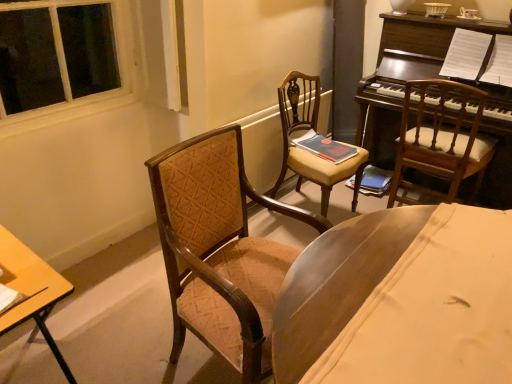
This screenshot has width=512, height=384. Describe the element at coordinates (441, 138) in the screenshot. I see `wooden chair at right, which ranks as the 3th chair in left-to-right order` at that location.

What is the approximate height of wooden desk at lower left?

wooden desk at lower left is 28.07 inches tall.

Image resolution: width=512 pixels, height=384 pixels. I want to click on dark brown polished wood piano at upper right, so click(405, 73).

This screenshot has height=384, width=512. What do you see at coordinates (405, 73) in the screenshot?
I see `dark brown polished wood piano at upper right` at bounding box center [405, 73].

What do you see at coordinates (375, 181) in the screenshot?
I see `hardcover book at center, positioned as the 2th book in front-to-back order` at bounding box center [375, 181].

Image resolution: width=512 pixels, height=384 pixels. What are the coordinates of `matte brown wooden chair at center, which is counted as the 2th chair, starting from the right` in the screenshot? It's located at (305, 134).

Locate an element on the screen. wooden chair at right, which ranks as the 3th chair in left-to-right order is located at coordinates (441, 138).

Could you tell me if matte brown wooden chair at center, which is the second chair from left to right, is turned towards wooden desk at lower left?

No, matte brown wooden chair at center, which is the second chair from left to right, is not turned towards wooden desk at lower left.

Can you see matte brown wooden chair at center, which is the second chair from left to right, touching wooden desk at lower left?

No, matte brown wooden chair at center, which is the second chair from left to right, is not next to wooden desk at lower left.

Image resolution: width=512 pixels, height=384 pixels. What are the coordinates of `desk below the matte brown wooden chair at center, which is counted as the 2th chair, starting from the right (from the image's perspective)` in the screenshot? It's located at (32, 291).

Considering the relative positions of velvet brown armchair at center, positioned as the 1th chair in left-to-right order, and hardcover book at center, the second book when ordered from left to right, in the image provided, is velvet brown armchair at center, positioned as the 1th chair in left-to-right order, to the left or to the right of hardcover book at center, the second book when ordered from left to right,?

velvet brown armchair at center, positioned as the 1th chair in left-to-right order, is positioned on hardcover book at center, the second book when ordered from left to right,'s left side.

Is velvet brown armchair at center, the third chair when ordered from right to left, thinner than hardcover book at center, which is counted as the first book, starting from the back?

No.

Can you tell me how much velvet brown armchair at center, the third chair when ordered from right to left, and hardcover book at center, the 1th book positioned from the right, differ in facing direction?

velvet brown armchair at center, the third chair when ordered from right to left, and hardcover book at center, the 1th book positioned from the right, are facing 93.8 degrees away from each other.

Considering the relative sizes of velvet brown armchair at center, the third chair when ordered from right to left, and hardcover book at center, which is counted as the first book, starting from the back, in the image provided, is velvet brown armchair at center, the third chair when ordered from right to left, smaller than hardcover book at center, which is counted as the first book, starting from the back,?

No, velvet brown armchair at center, the third chair when ordered from right to left, is not smaller than hardcover book at center, which is counted as the first book, starting from the back.

Is wooden chair at right, the first chair from the right, positioned far away from hardcover book at center, positioned as the 2th book in front-to-back order?

No, wooden chair at right, the first chair from the right, is not far away from hardcover book at center, positioned as the 2th book in front-to-back order.

Considering the relative positions of wooden chair at right, which ranks as the 3th chair in left-to-right order, and hardcover book at center, which is counted as the first book, starting from the back, in the image provided, is wooden chair at right, which ranks as the 3th chair in left-to-right order, to the left of hardcover book at center, which is counted as the first book, starting from the back, from the viewer's perspective?

No.

From the image's perspective, which one is positioned lower, wooden chair at right, the first chair from the right, or hardcover book at center, positioned as the 2th book in front-to-back order?

hardcover book at center, positioned as the 2th book in front-to-back order.

Which is closer to the camera, (393, 191) or (355, 179)?

The point (393, 191) is more forward.

Does matte red book at center, the first book positioned from the front, turn towards wooden chair at right, which ranks as the 3th chair in left-to-right order?

No, matte red book at center, the first book positioned from the front, does not turn towards wooden chair at right, which ranks as the 3th chair in left-to-right order.

The image size is (512, 384). I want to click on chair that is on the right side of matte red book at center, the first book positioned from the front, so click(x=441, y=138).

Is matte red book at center, the 2th book when ordered from right to left, smaller than wooden chair at right, the first chair from the right?

Yes.

Based on the photo, can you tell me how much matte red book at center, the 2th book when ordered from right to left, and wooden chair at right, the first chair from the right, differ in facing direction?

They differ by 99.1 degrees in their facing directions.

Locate an element on the screen. Image resolution: width=512 pixels, height=384 pixels. the 2nd chair to the left of the wooden chair at right, which ranks as the 3th chair in left-to-right order, starting your count from the anchor is located at coordinates (219, 250).

Does point (207, 206) come farther from viewer compared to point (473, 147)?

No, it is in front of (473, 147).

Is wooden chair at right, which ranks as the 3th chair in left-to-right order, at the back of velvet brown armchair at center, positioned as the 1th chair in left-to-right order?

That's not correct — velvet brown armchair at center, positioned as the 1th chair in left-to-right order, is not looking away from wooden chair at right, which ranks as the 3th chair in left-to-right order.

From the picture: Considering the positions of objects velvet brown armchair at center, positioned as the 1th chair in left-to-right order, and wooden chair at right, which ranks as the 3th chair in left-to-right order, in the image provided, who is more to the right, velvet brown armchair at center, positioned as the 1th chair in left-to-right order, or wooden chair at right, which ranks as the 3th chair in left-to-right order,?

wooden chair at right, which ranks as the 3th chair in left-to-right order.

Which is behind, point (323, 155) or point (509, 143)?

The point (509, 143) is more distant.

From the image's perspective, is matte red book at center, marked as the 1th book in a left-to-right arrangement, on top of dark brown polished wood piano at upper right?

Actually, matte red book at center, marked as the 1th book in a left-to-right arrangement, appears below dark brown polished wood piano at upper right in the image.

The width and height of the screenshot is (512, 384). I want to click on piano above the matte red book at center, the first book positioned from the front (from a real-world perspective), so click(x=405, y=73).

From a real-world perspective, is matte red book at center, which is the 2th book in back-to-front order, over dark brown polished wood piano at upper right?

Actually, matte red book at center, which is the 2th book in back-to-front order, is physically below dark brown polished wood piano at upper right in the real world.

Is matte red book at center, which is the 2th book in back-to-front order, spatially inside hardcover book at center, which is counted as the first book, starting from the back, or outside of it?

matte red book at center, which is the 2th book in back-to-front order, is outside hardcover book at center, which is counted as the first book, starting from the back.

From the image's perspective, between matte red book at center, marked as the 1th book in a left-to-right arrangement, and hardcover book at center, the 1th book positioned from the right, who is located below?

hardcover book at center, the 1th book positioned from the right.

What's the angular difference between matte red book at center, the first book positioned from the front, and hardcover book at center, positioned as the 2th book in front-to-back order,'s facing directions?

The angular difference between matte red book at center, the first book positioned from the front, and hardcover book at center, positioned as the 2th book in front-to-back order, is 84.4 degrees.

Considering the relative sizes of matte red book at center, which is the 2th book in back-to-front order, and hardcover book at center, the second book when ordered from left to right, in the image provided, is matte red book at center, which is the 2th book in back-to-front order, shorter than hardcover book at center, the second book when ordered from left to right,?

Correct, matte red book at center, which is the 2th book in back-to-front order, is not as tall as hardcover book at center, the second book when ordered from left to right.

Starting from the wooden desk at lower left, which chair is the 3rd one behind? Please provide its 2D coordinates.

[(305, 134)]

Starting from the velvet brown armchair at center, the third chair when ordered from right to left, which book is the 2nd one to the right? Please provide its 2D coordinates.

[(375, 181)]

When comparing their distances from matte brown wooden chair at center, which is the second chair from left to right, does wooden chair at right, which ranks as the 3th chair in left-to-right order, or dark brown polished wood piano at upper right seem further?

dark brown polished wood piano at upper right is positioned further to the anchor matte brown wooden chair at center, which is the second chair from left to right.

Considering their positions, is velvet brown armchair at center, positioned as the 1th chair in left-to-right order, positioned closer to dark brown polished wood piano at upper right than hardcover book at center, the 1th book positioned from the right?

hardcover book at center, the 1th book positioned from the right, is positioned closer to the anchor dark brown polished wood piano at upper right.

In the scene shown: Based on their spatial positions, is wooden chair at right, the first chair from the right, or wooden desk at lower left further from dark brown polished wood piano at upper right?

Based on the image, wooden desk at lower left appears to be further to dark brown polished wood piano at upper right.

Considering their positions, is hardcover book at center, which is counted as the first book, starting from the back, positioned closer to dark brown polished wood piano at upper right than matte red book at center, which is the 2th book in back-to-front order?

hardcover book at center, which is counted as the first book, starting from the back, is closer to dark brown polished wood piano at upper right.

Which object lies further to the anchor point dark brown polished wood piano at upper right, wooden chair at right, which ranks as the 3th chair in left-to-right order, or matte brown wooden chair at center, which is counted as the 2th chair, starting from the right?

matte brown wooden chair at center, which is counted as the 2th chair, starting from the right, is positioned further to the anchor dark brown polished wood piano at upper right.

Considering their positions, is matte brown wooden chair at center, which is the second chair from left to right, positioned closer to hardcover book at center, positioned as the 2th book in front-to-back order, than wooden desk at lower left?

matte brown wooden chair at center, which is the second chair from left to right, is positioned closer to the anchor hardcover book at center, positioned as the 2th book in front-to-back order.

Looking at this image, from the image, which object appears to be farther from matte red book at center, marked as the 1th book in a left-to-right arrangement, dark brown polished wood piano at upper right or hardcover book at center, positioned as the 2th book in front-to-back order?

dark brown polished wood piano at upper right is positioned further to the anchor matte red book at center, marked as the 1th book in a left-to-right arrangement.

When comparing their distances from matte red book at center, marked as the 1th book in a left-to-right arrangement, does wooden desk at lower left or matte brown wooden chair at center, which is counted as the 2th chair, starting from the right, seem closer?

The object closer to matte red book at center, marked as the 1th book in a left-to-right arrangement, is matte brown wooden chair at center, which is counted as the 2th chair, starting from the right.

Locate an element on the screen. This screenshot has width=512, height=384. piano between matte brown wooden chair at center, which is the second chair from left to right, and hardcover book at center, positioned as the 2th book in front-to-back order, in the front-back direction is located at coordinates (405, 73).

Where is `book between wooden chair at right, which ranks as the 3th chair in left-to-right order, and hardcover book at center, positioned as the 2th book in front-to-back order, from front to back`? The width and height of the screenshot is (512, 384). book between wooden chair at right, which ranks as the 3th chair in left-to-right order, and hardcover book at center, positioned as the 2th book in front-to-back order, from front to back is located at coordinates (324, 147).

This screenshot has width=512, height=384. What are the coordinates of `piano located between velvet brown armchair at center, positioned as the 1th chair in left-to-right order, and hardcover book at center, the 1th book positioned from the right, in the depth direction` in the screenshot? It's located at (405, 73).

You are a GUI agent. You are given a task and a screenshot of the screen. Output one action in this format:
    pyautogui.click(x=<x>, y=<y>)
    Task: Click on the book between matte brown wooden chair at center, which is the second chair from left to right, and hardcover book at center, which is counted as the first book, starting from the back, along the z-axis
    The width and height of the screenshot is (512, 384).
    Given the screenshot: What is the action you would take?
    pyautogui.click(x=324, y=147)